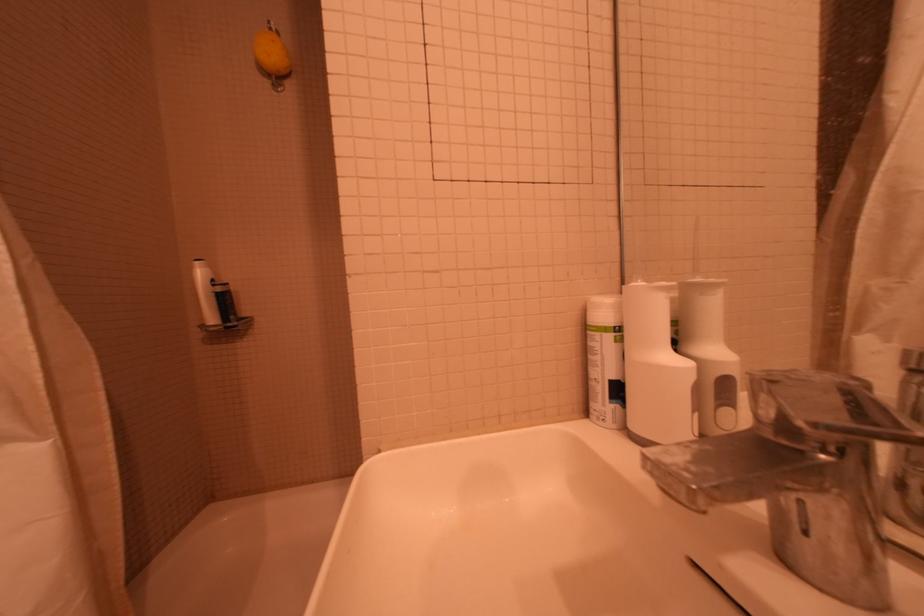
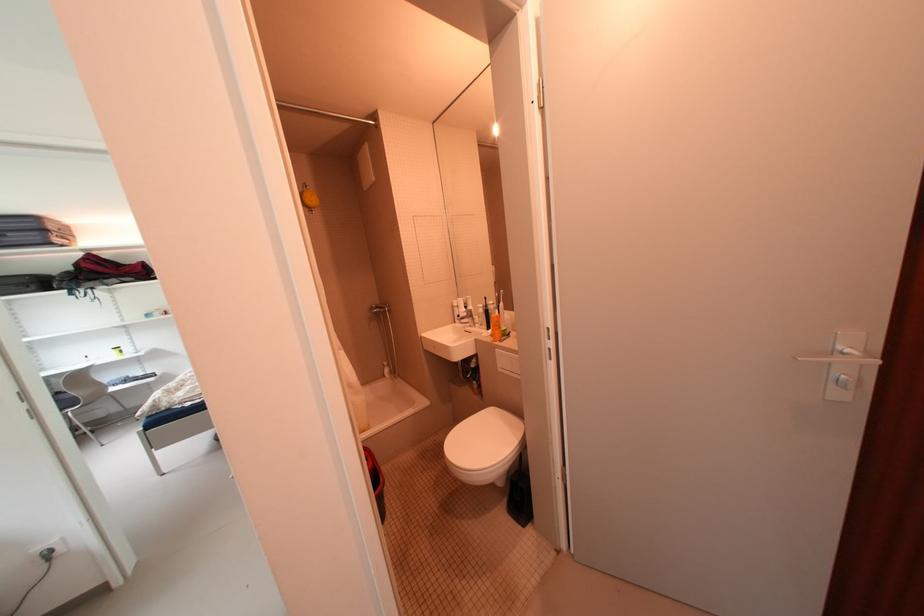
Where in the second image is the point corresponding to [593,330] from the first image?

(460, 308)